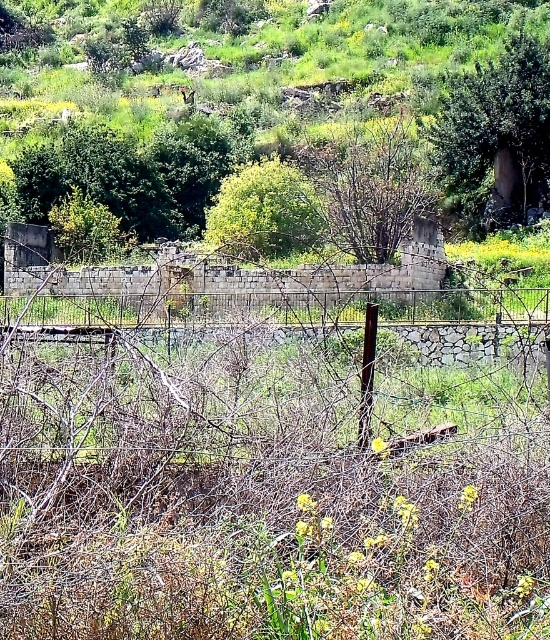
You are standing in the rural scene and see the bare branches at center and the green leafy tree at center. Which one is located to the right of the other?

The bare branches at center is positioned on the right side of green leafy tree at center.

You are standing at the point marked as point (371, 186) in the image. What do you see directly in front of you?

You see bare branches at center directly in front of you at point (371, 186).

You are standing in the rural scene and want to take a photo of both the green leafy tree at upper right and the bare branches at center. Which object should you adjust your camera focus on first to ensure both are in the same frame?

The green leafy tree at upper right is closer to you than the bare branches at center, so you should focus on the bare branches at center first to ensure both are in the same frame.